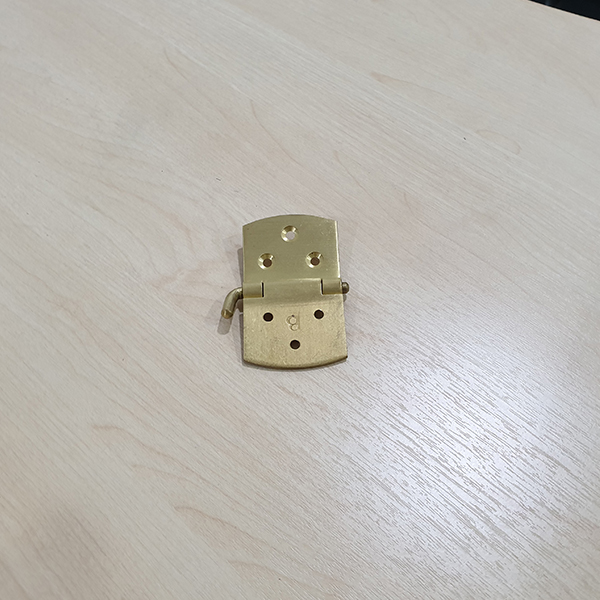
At what (x,y) coordinates should I click in order to perform the action: click on table. Please return your answer as a coordinate pair (x, y). This screenshot has height=600, width=600. Looking at the image, I should click on (213, 173).